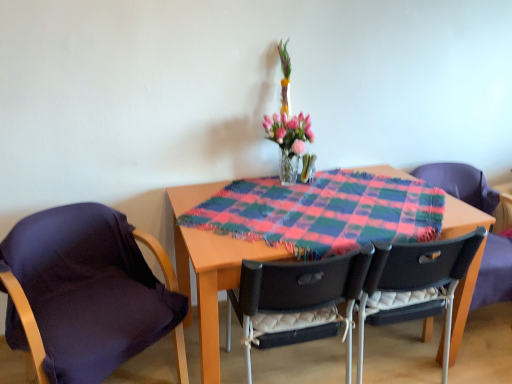
Question: Does plaid fabric at center have a smaller size compared to translucent glass vase at center?

Choices:
 (A) no
 (B) yes

Answer: (A)

Question: From the image's perspective, does plaid fabric at center appear lower than translucent glass vase at center?

Choices:
 (A) no
 (B) yes

Answer: (B)

Question: From a real-world perspective, is plaid fabric at center positioned over translucent glass vase at center based on gravity?

Choices:
 (A) no
 (B) yes

Answer: (A)

Question: Is plaid fabric at center to the left of translucent glass vase at center from the viewer's perspective?

Choices:
 (A) yes
 (B) no

Answer: (B)

Question: Is plaid fabric at center at the right side of translucent glass vase at center?

Choices:
 (A) yes
 (B) no

Answer: (A)

Question: From the image's perspective, is translucent glass vase at center positioned above or below dark purple fabric at left, acting as the 1th chair starting from the left?

Choices:
 (A) below
 (B) above

Answer: (B)

Question: Is translucent glass vase at center inside the boundaries of dark purple fabric at left, acting as the 1th chair starting from the left, or outside?

Choices:
 (A) inside
 (B) outside

Answer: (B)

Question: From a real-world perspective, is translucent glass vase at center above or below dark purple fabric at left, acting as the 1th chair starting from the left?

Choices:
 (A) above
 (B) below

Answer: (A)

Question: Is translucent glass vase at center wider or thinner than dark purple fabric at left, the 4th chair positioned from the right?

Choices:
 (A) wide
 (B) thin

Answer: (B)

Question: Considering the positions of plaid fabric at center and matte black chair at right, the fourth chair from the left, in the image, is plaid fabric at center taller or shorter than matte black chair at right, the fourth chair from the left,?

Choices:
 (A) tall
 (B) short

Answer: (B)

Question: From a real-world perspective, is plaid fabric at center physically located above or below matte black chair at right, the fourth chair from the left?

Choices:
 (A) below
 (B) above

Answer: (B)

Question: Is plaid fabric at center situated inside matte black chair at right, which appears as the 1th chair when viewed from the right, or outside?

Choices:
 (A) inside
 (B) outside

Answer: (B)

Question: In the image, is plaid fabric at center positioned in front of or behind matte black chair at right, which appears as the 1th chair when viewed from the right?

Choices:
 (A) front
 (B) behind

Answer: (A)

Question: Based on their positions, is dark purple fabric at left, the 4th chair positioned from the right, located to the left or right of translucent glass vase at center?

Choices:
 (A) right
 (B) left

Answer: (B)

Question: From their relative heights in the image, would you say dark purple fabric at left, the 4th chair positioned from the right, is taller or shorter than translucent glass vase at center?

Choices:
 (A) tall
 (B) short

Answer: (A)